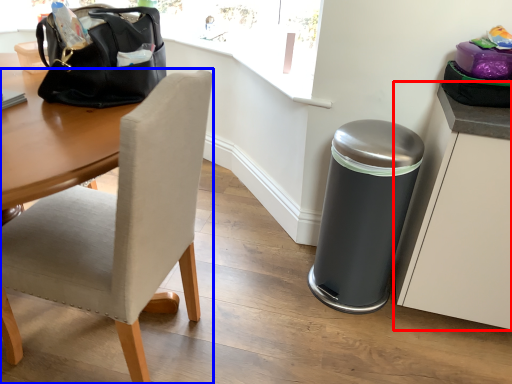
Question: Which of the following is the farthest to the observer, cabinetry (highlighted by a red box) or chair (highlighted by a blue box)?

Choices:
 (A) cabinetry
 (B) chair

Answer: (A)